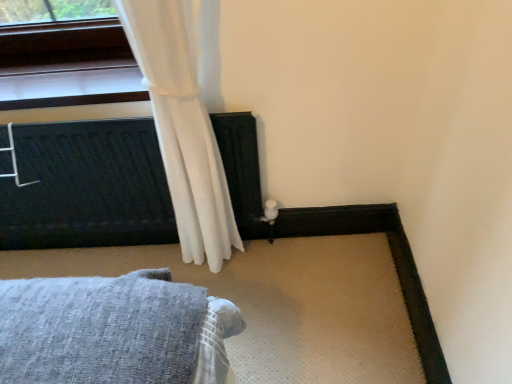
You are a GUI agent. You are given a task and a screenshot of the screen. Output one action in this format:
    pyautogui.click(x=<x>, y=<y>)
    Task: Click on the vacant area that is situated to the right of textured gray blanket at lower left
    Image resolution: width=512 pixels, height=384 pixels.
    Given the screenshot: What is the action you would take?
    pyautogui.click(x=284, y=294)